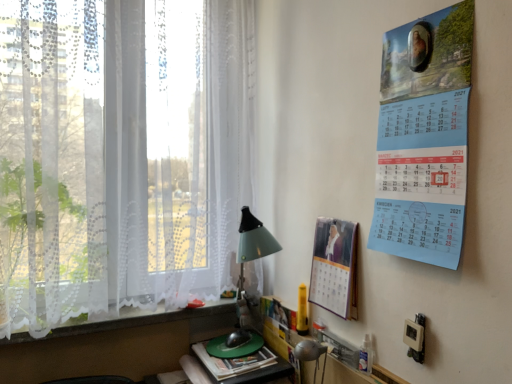
Question: From the image's perspective, is matte green table lamp at lower center above or below matte paper calendar at right, marked as the second poster page in a right-to-left arrangement?

Choices:
 (A) above
 (B) below

Answer: (B)

Question: From a real-world perspective, is matte green table lamp at lower center above or below matte paper calendar at right, arranged as the 1th poster page when viewed from the left?

Choices:
 (A) below
 (B) above

Answer: (A)

Question: Estimate the real-world distances between objects in this image. Which object is closer to the matte paper calendar at right, which is the first poster page from back to front?

Choices:
 (A) blue paper calendar at upper right, the second poster page from the back
 (B) green plastic computer mouse at lower center
 (C) white lace at lower left
 (D) white lace curtain at left
 (E) matte green table lamp at lower center

Answer: (E)

Question: Which is farther from the blue paper calendar at upper right, which is the 1th poster page in front-to-back order?

Choices:
 (A) green plastic computer mouse at lower center
 (B) matte paper calendar at right, marked as the second poster page in a right-to-left arrangement
 (C) white lace curtain at left
 (D) white lace at lower left
 (E) matte green table lamp at lower center

Answer: (D)